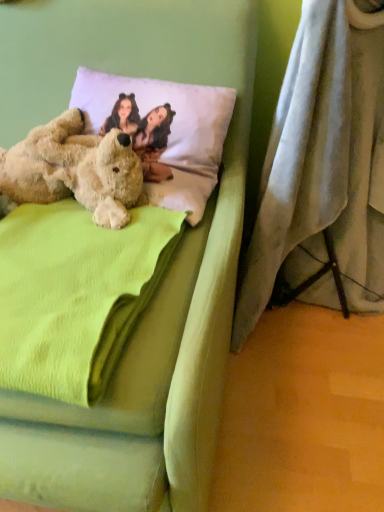
Question: Considering the relative sizes of gray fabric curtain at lower right and soft green fabric bed at center in the image provided, is gray fabric curtain at lower right wider than soft green fabric bed at center?

Choices:
 (A) yes
 (B) no

Answer: (B)

Question: Would you say gray fabric curtain at lower right is a long distance from soft green fabric bed at center?

Choices:
 (A) yes
 (B) no

Answer: (B)

Question: Considering the relative sizes of gray fabric curtain at lower right and soft green fabric bed at center in the image provided, is gray fabric curtain at lower right thinner than soft green fabric bed at center?

Choices:
 (A) yes
 (B) no

Answer: (A)

Question: Could you tell me if gray fabric curtain at lower right is facing soft green fabric bed at center?

Choices:
 (A) no
 (B) yes

Answer: (A)

Question: Considering the relative sizes of gray fabric curtain at lower right and soft green fabric bed at center in the image provided, is gray fabric curtain at lower right bigger than soft green fabric bed at center?

Choices:
 (A) yes
 (B) no

Answer: (B)

Question: From the image's perspective, is green fleece blanket at center positioned above or below white soft pillow at upper center?

Choices:
 (A) above
 (B) below

Answer: (B)

Question: Is point (44, 326) closer or farther from the camera than point (228, 119)?

Choices:
 (A) closer
 (B) farther

Answer: (A)

Question: Is green fleece blanket at center spatially inside white soft pillow at upper center, or outside of it?

Choices:
 (A) outside
 (B) inside

Answer: (A)

Question: Looking at the image, does green fleece blanket at center seem bigger or smaller compared to white soft pillow at upper center?

Choices:
 (A) small
 (B) big

Answer: (B)

Question: In the image, is soft green fabric bed at center positioned in front of or behind gray fabric curtain at lower right?

Choices:
 (A) front
 (B) behind

Answer: (A)

Question: Considering the positions of point (81, 32) and point (340, 25), is point (81, 32) closer or farther from the camera than point (340, 25)?

Choices:
 (A) farther
 (B) closer

Answer: (A)

Question: In terms of size, does soft green fabric bed at center appear bigger or smaller than gray fabric curtain at lower right?

Choices:
 (A) small
 (B) big

Answer: (B)

Question: From the image's perspective, is soft green fabric bed at center located above or below gray fabric curtain at lower right?

Choices:
 (A) above
 (B) below

Answer: (B)

Question: From a real-world perspective, is green fleece blanket at center positioned above or below fuzzy beige teddy bear at left?

Choices:
 (A) below
 (B) above

Answer: (A)

Question: In terms of width, does green fleece blanket at center look wider or thinner when compared to fuzzy beige teddy bear at left?

Choices:
 (A) thin
 (B) wide

Answer: (B)